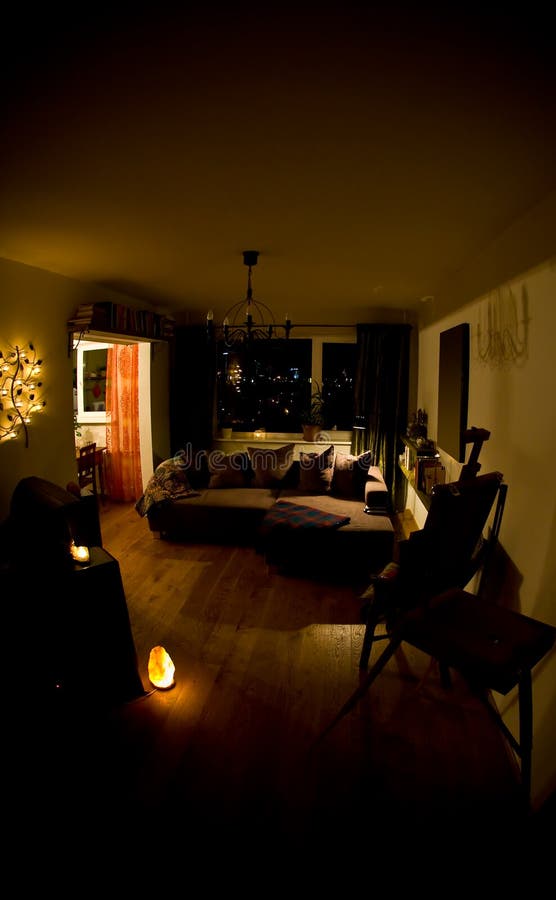
The width and height of the screenshot is (556, 900). In order to click on books in this screenshot , I will do `click(134, 321)`.